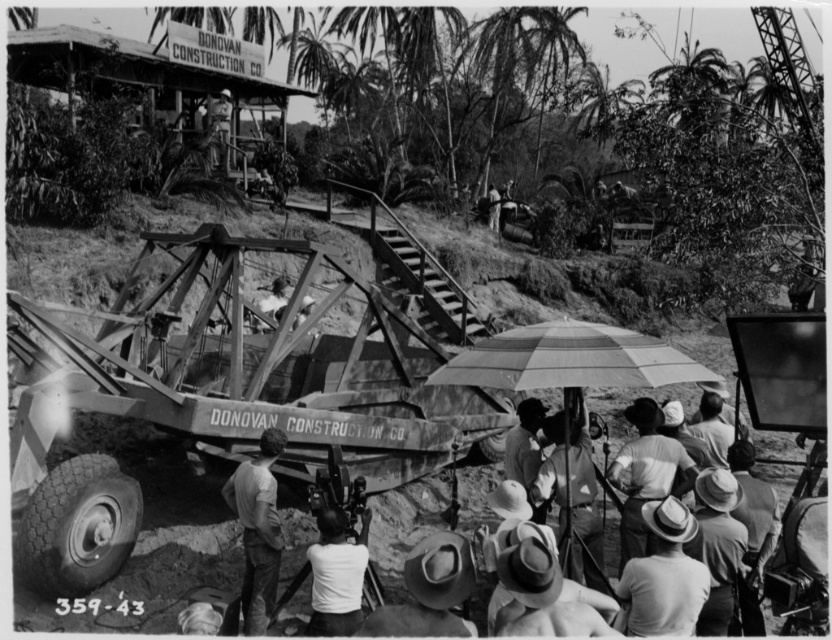
Question: Is light brown straw hat at lower center wider than light brown straw hat at lower right?

Choices:
 (A) yes
 (B) no

Answer: (A)

Question: Which point is closer to the camera?

Choices:
 (A) light brown straw hat at center
 (B) metal helmet at center

Answer: (A)

Question: Is rustic straw hat at lower center to the left of light gray cotton shirt at center from the viewer's perspective?

Choices:
 (A) no
 (B) yes

Answer: (A)

Question: Which of these objects is positioned closest to the light gray cotton shirt at center?

Choices:
 (A) dark fabric shirt at center
 (B) white cotton shirt at center
 (C) rustic straw hat at lower center
 (D) light brown straw hat at lower center

Answer: (C)

Question: Does metallic construction equipment at center lie in front of light brown wooden chair at upper center?

Choices:
 (A) yes
 (B) no

Answer: (A)

Question: Which of these objects is positioned farthest from the light brown wooden chair at upper center?

Choices:
 (A) white matte shirt at center
 (B) dark fabric shirt at center
 (C) metal helmet at center

Answer: (A)